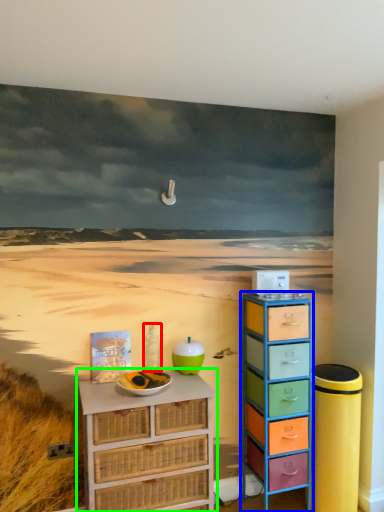
Question: Which is farther away from bottle (highlighted by a red box)? chest of drawers (highlighted by a blue box) or chest of drawers (highlighted by a green box)?

Choices:
 (A) chest of drawers
 (B) chest of drawers

Answer: (A)